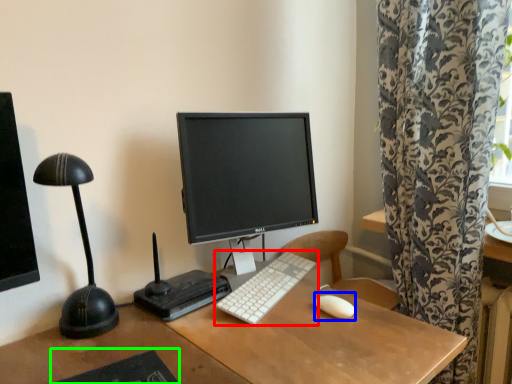
Question: Which is farther away from computer keyboard (highlighted by a red box)? mouse (highlighted by a blue box) or mousepad (highlighted by a green box)?

Choices:
 (A) mouse
 (B) mousepad

Answer: (B)